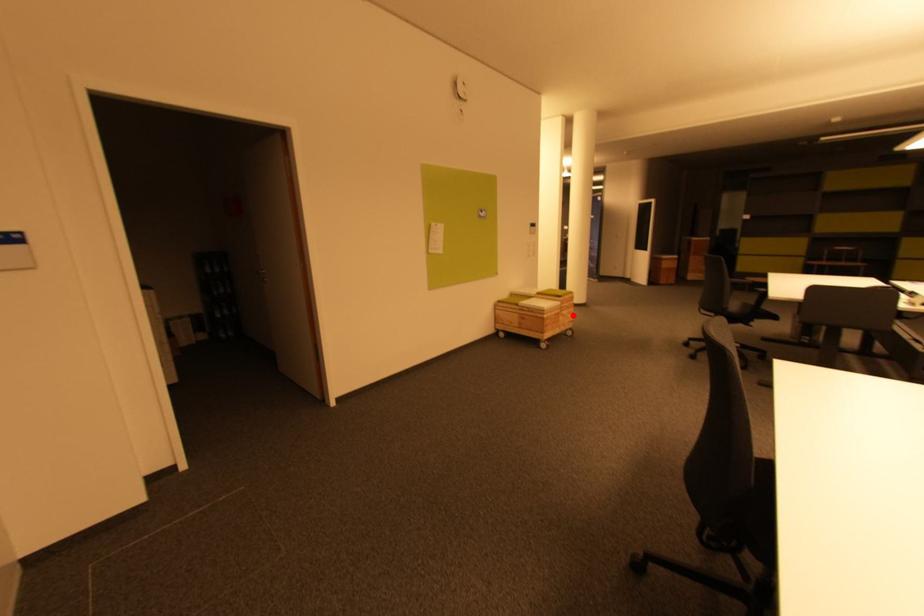
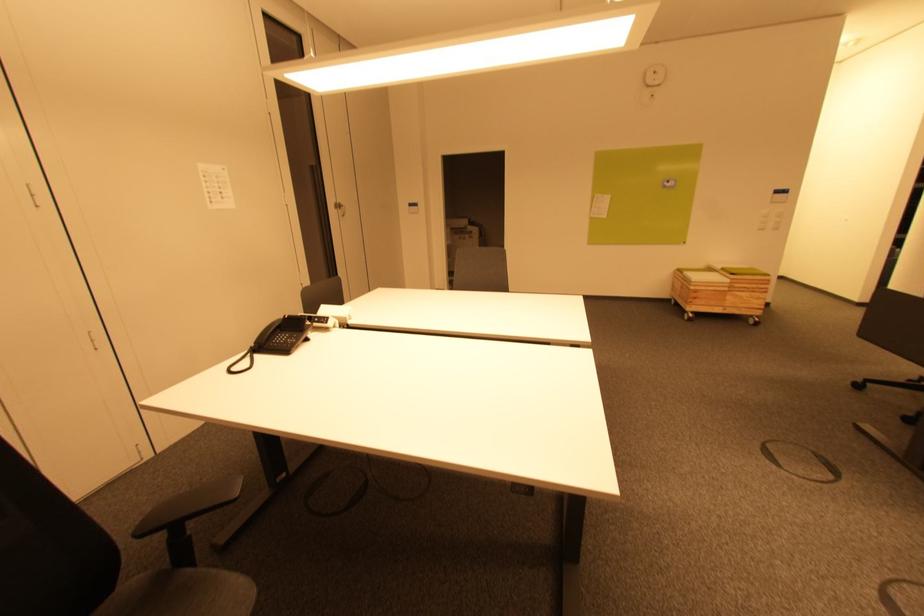
Find the pixel in the second image that matches the highlighted location in the first image.

(756, 300)